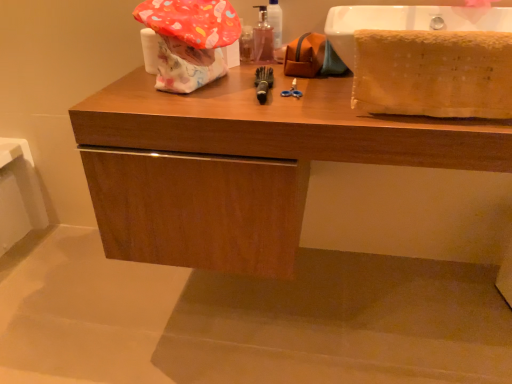
Question: Is point (254, 51) closer or farther from the camera than point (496, 135)?

Choices:
 (A) closer
 (B) farther

Answer: (B)

Question: Is translucent plastic mouthwash at center wider or thinner than wooden cabinet at center?

Choices:
 (A) thin
 (B) wide

Answer: (A)

Question: Which of these objects is positioned closest to the translucent plastic mouthwash at center?

Choices:
 (A) wooden cabinet at center
 (B) soft yellow towel at right
 (C) black rubber toothbrush at center

Answer: (C)

Question: Based on their relative distances, which object is nearer to the soft yellow towel at right?

Choices:
 (A) black rubber toothbrush at center
 (B) translucent plastic mouthwash at center
 (C) wooden cabinet at center

Answer: (C)